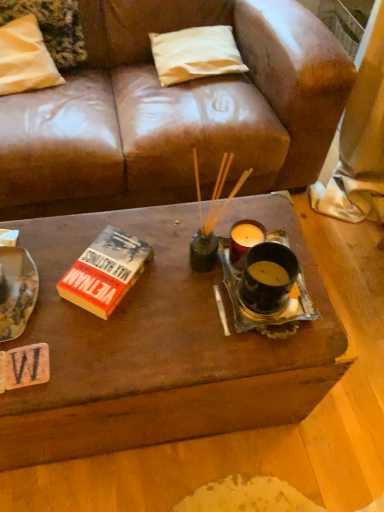
Question: From a real-world perspective, is white fabric pillow at upper center, which is the first pillow in right-to-left order, located higher than hardcover book at center-left?

Choices:
 (A) yes
 (B) no

Answer: (B)

Question: Can you confirm if white fabric pillow at upper center, the second pillow when ordered from left to right, is shorter than hardcover book at center-left?

Choices:
 (A) no
 (B) yes

Answer: (A)

Question: Can you confirm if white fabric pillow at upper center, which is the first pillow in right-to-left order, is thinner than hardcover book at center-left?

Choices:
 (A) yes
 (B) no

Answer: (B)

Question: Considering the relative positions of white fabric pillow at upper center, which is the first pillow in right-to-left order, and hardcover book at center-left in the image provided, is white fabric pillow at upper center, which is the first pillow in right-to-left order, to the right of hardcover book at center-left from the viewer's perspective?

Choices:
 (A) no
 (B) yes

Answer: (B)

Question: From the image's perspective, does white fabric pillow at upper center, which is the first pillow in right-to-left order, appear higher than hardcover book at center-left?

Choices:
 (A) yes
 (B) no

Answer: (A)

Question: Considering the relative sizes of white fabric pillow at upper center, which is the first pillow in right-to-left order, and hardcover book at center-left in the image provided, is white fabric pillow at upper center, which is the first pillow in right-to-left order, taller than hardcover book at center-left?

Choices:
 (A) no
 (B) yes

Answer: (B)

Question: Is white fabric pillow at upper center, which is the first pillow in right-to-left order, aimed at white fabric pillow at upper left, the first pillow from the left?

Choices:
 (A) yes
 (B) no

Answer: (B)

Question: Does white fabric pillow at upper center, the second pillow when ordered from left to right, come behind white fabric pillow at upper left, positioned as the 2th pillow in right-to-left order?

Choices:
 (A) no
 (B) yes

Answer: (B)

Question: From the image's perspective, would you say white fabric pillow at upper center, which is the first pillow in right-to-left order, is shown under white fabric pillow at upper left, the first pillow from the left?

Choices:
 (A) no
 (B) yes

Answer: (B)

Question: Considering the relative positions of white fabric pillow at upper center, the second pillow when ordered from left to right, and white fabric pillow at upper left, positioned as the 2th pillow in right-to-left order, in the image provided, is white fabric pillow at upper center, the second pillow when ordered from left to right, to the left of white fabric pillow at upper left, positioned as the 2th pillow in right-to-left order, from the viewer's perspective?

Choices:
 (A) yes
 (B) no

Answer: (B)

Question: Is white fabric pillow at upper center, the second pillow when ordered from left to right, thinner than white fabric pillow at upper left, positioned as the 2th pillow in right-to-left order?

Choices:
 (A) yes
 (B) no

Answer: (A)

Question: Is white fabric pillow at upper center, the second pillow when ordered from left to right, to the right of white fabric pillow at upper left, positioned as the 2th pillow in right-to-left order, from the viewer's perspective?

Choices:
 (A) yes
 (B) no

Answer: (A)

Question: Is white fabric pillow at upper left, positioned as the 2th pillow in right-to-left order, oriented away from white fabric pillow at upper center, which is the first pillow in right-to-left order?

Choices:
 (A) no
 (B) yes

Answer: (A)